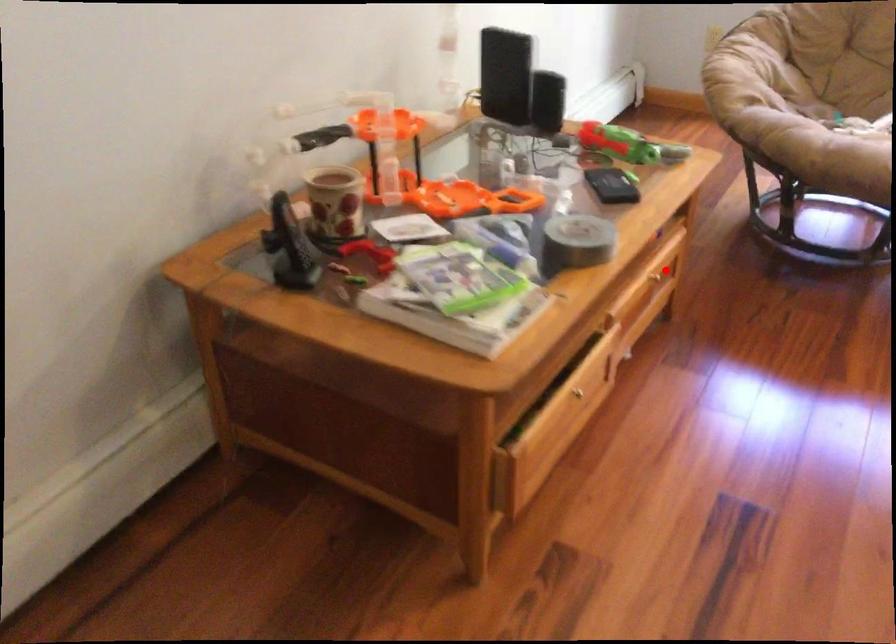
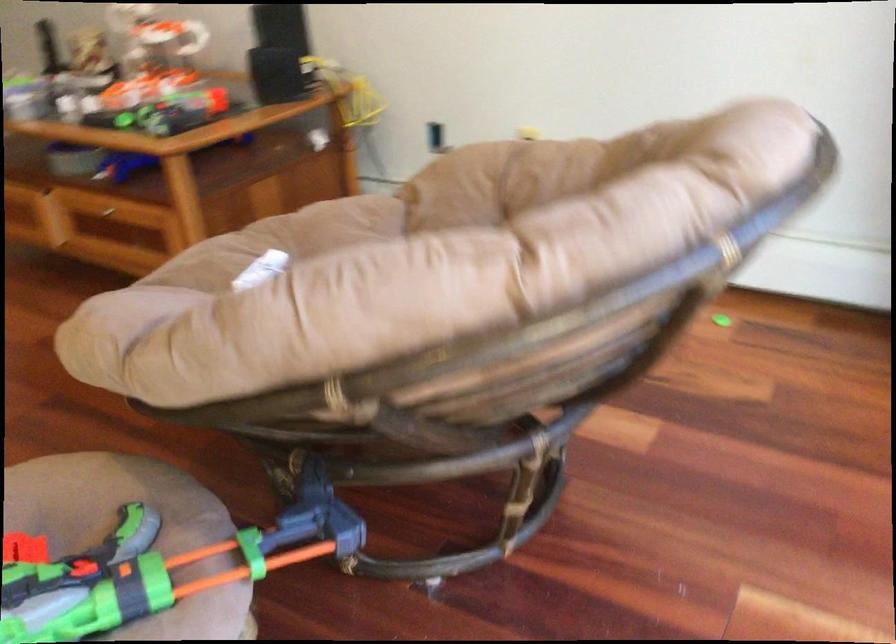
The point at the highlighted location is marked in the first image. Where is the corresponding point in the second image?

(107, 213)